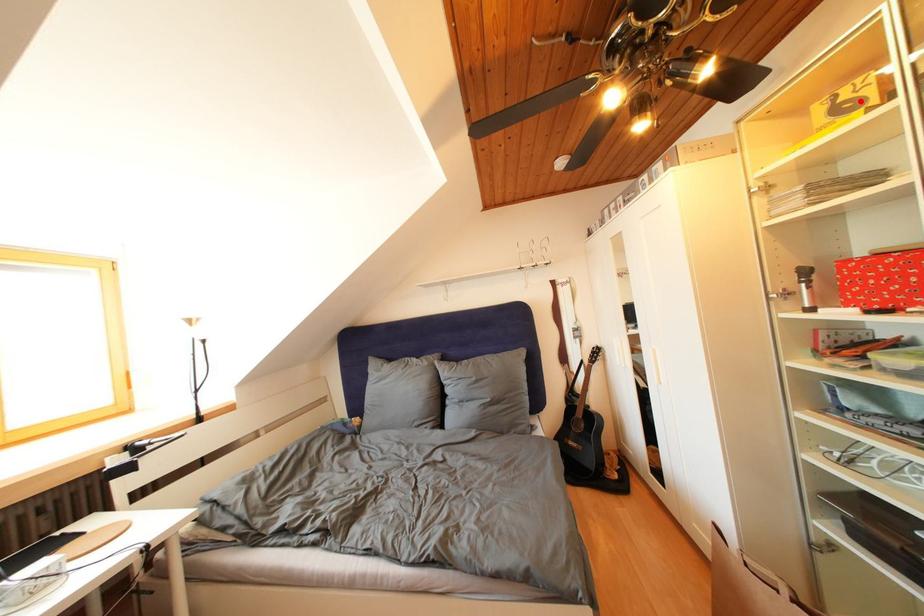
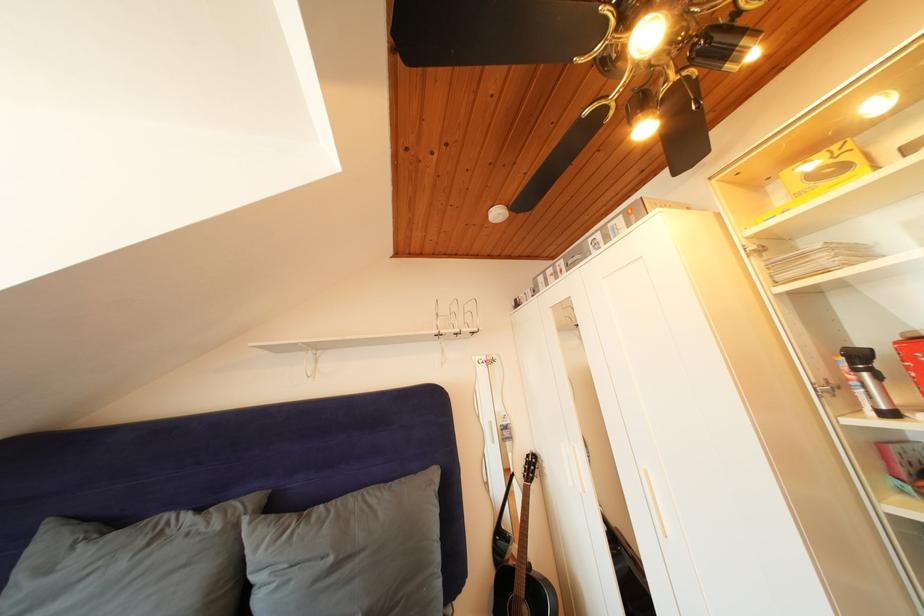
In the second image, find the point that corresponds to the highlighted location in the first image.

(841, 167)